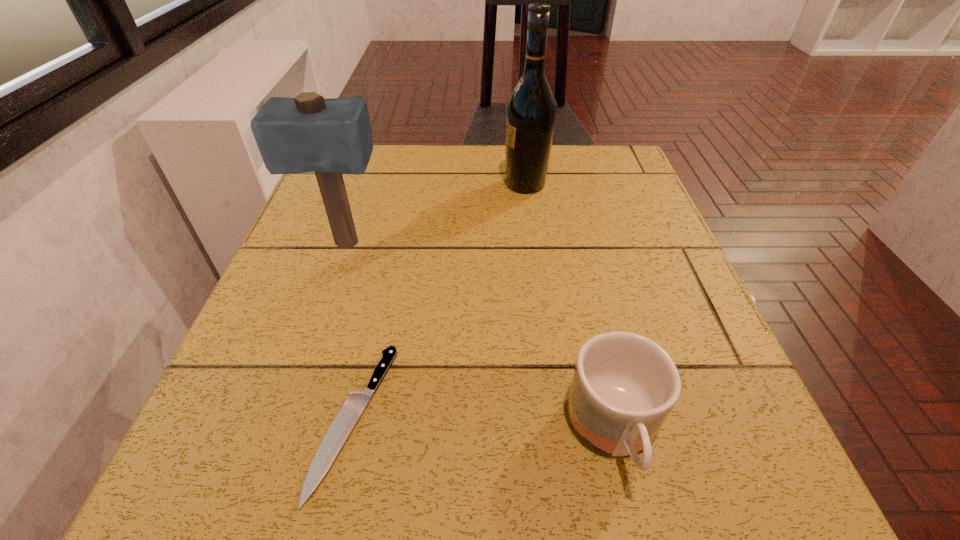
This screenshot has width=960, height=540. In the image, there is a desktop. Find the location of `blank space at the right edge`. blank space at the right edge is located at coordinates (699, 325).

This screenshot has width=960, height=540. In order to click on vacant space at the near left corner of the desktop in this screenshot , I will do `click(299, 494)`.

Where is `vacant space at the far right corner`? The height and width of the screenshot is (540, 960). vacant space at the far right corner is located at coordinates (588, 150).

Where is `free spot between the mallet and the tallest object`? Image resolution: width=960 pixels, height=540 pixels. free spot between the mallet and the tallest object is located at coordinates (436, 214).

The height and width of the screenshot is (540, 960). I want to click on empty space that is in between the shortest object and the farthest object, so click(441, 301).

This screenshot has height=540, width=960. Find the location of `free space between the mallet and the mug`. free space between the mallet and the mug is located at coordinates (480, 339).

Identify the location of free space between the shortest object and the tallest object. (441, 301).

The height and width of the screenshot is (540, 960). I want to click on free space that is in between the second farthest object and the shortest object, so click(350, 332).

You are a GUI agent. You are given a task and a screenshot of the screen. Output one action in this format:
    pyautogui.click(x=<x>, y=<y>)
    Task: Click on the empty space that is in between the steak knife and the third nearest object
    
    Given the screenshot: What is the action you would take?
    pyautogui.click(x=350, y=332)

Where is `free point between the wine bottle and the second farthest object`? The width and height of the screenshot is (960, 540). free point between the wine bottle and the second farthest object is located at coordinates (436, 214).